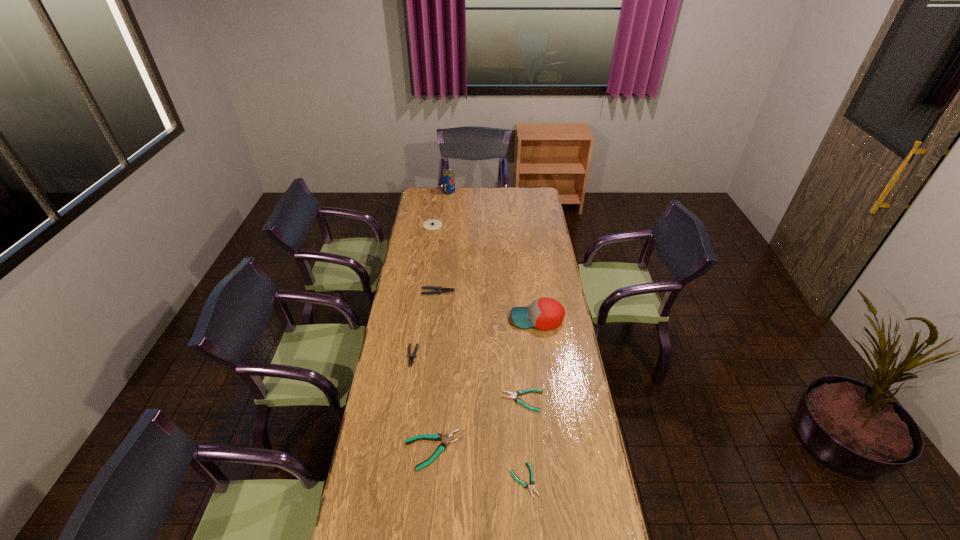
I want to click on teal pliers that stands as the closest to the leftmost teal pliers, so click(x=532, y=481).

Locate an element on the screen. The width and height of the screenshot is (960, 540). vacant area in the image that satisfies the following two spatial constraints: 1. on the back side of the third shortest pliers; 2. at the gripping part of the fourth tallest object is located at coordinates (446, 292).

At what (x,y) coordinates should I click in order to perform the action: click on free space that satisfies the following two spatial constraints: 1. at the gripping part of the biggest teal pliers; 2. on the right side of the smaller gray pliers. Please return your answer as a coordinate pair (x, y). This screenshot has height=540, width=960. Looking at the image, I should click on (398, 450).

At what (x,y) coordinates should I click in order to perform the action: click on free region that satisfies the following two spatial constraints: 1. at the gripping part of the third farthest pliers; 2. on the right side of the fourth nearest pliers. Please return your answer as a coordinate pair (x, y). Looking at the image, I should click on (406, 401).

You are a GUI agent. You are given a task and a screenshot of the screen. Output one action in this format:
    pyautogui.click(x=<x>, y=<y>)
    Task: Click on the free space that satisfies the following two spatial constraints: 1. at the brim of the red baseball cap; 2. at the gripping part of the second farthest pliers
    This screenshot has width=960, height=540.
    Given the screenshot: What is the action you would take?
    pyautogui.click(x=542, y=356)

Where is `blank space that satisfies the following two spatial constraints: 1. at the gripping part of the smallest teal pliers; 2. on the right side of the bigger gray pliers`? The width and height of the screenshot is (960, 540). blank space that satisfies the following two spatial constraints: 1. at the gripping part of the smallest teal pliers; 2. on the right side of the bigger gray pliers is located at coordinates (418, 480).